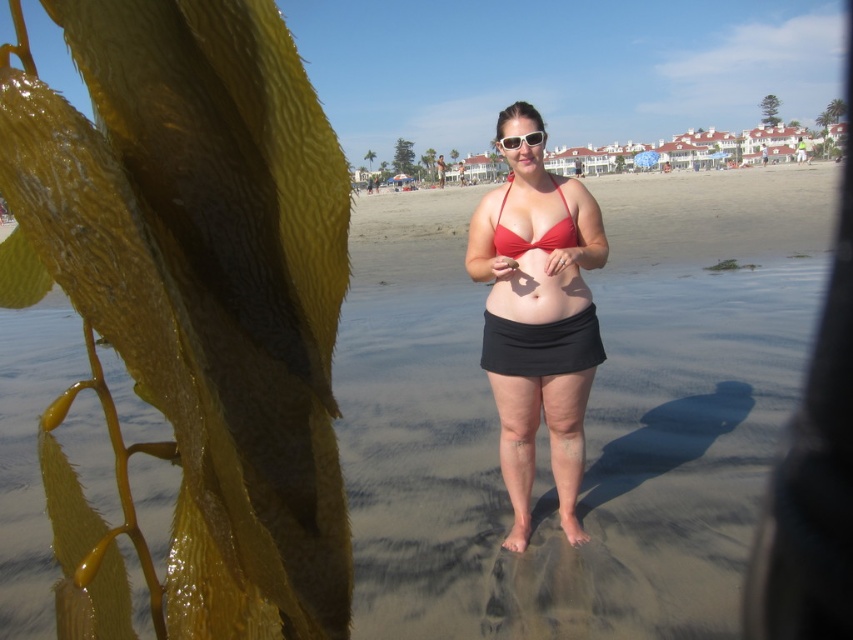
Question: Does red matte bikini top at center appear on the right side of matte red bikini top at center?

Choices:
 (A) yes
 (B) no

Answer: (A)

Question: Is red matte bikini top at center wider than matte red bikini top at center?

Choices:
 (A) no
 (B) yes

Answer: (B)

Question: Which object appears farthest from the camera in this image?

Choices:
 (A) matte red bikini top at center
 (B) matte skin at center
 (C) red matte bikini top at center

Answer: (A)

Question: Which object appears farthest from the camera in this image?

Choices:
 (A) matte skin at center
 (B) white plastic sunglasses at center

Answer: (B)

Question: Considering the real-world distances, which object is closest to the red matte bikini top at center?

Choices:
 (A) matte skin at center
 (B) white plastic sunglasses at center

Answer: (A)

Question: Can you confirm if red matte bikini top at center is wider than matte red bikini top at center?

Choices:
 (A) yes
 (B) no

Answer: (A)